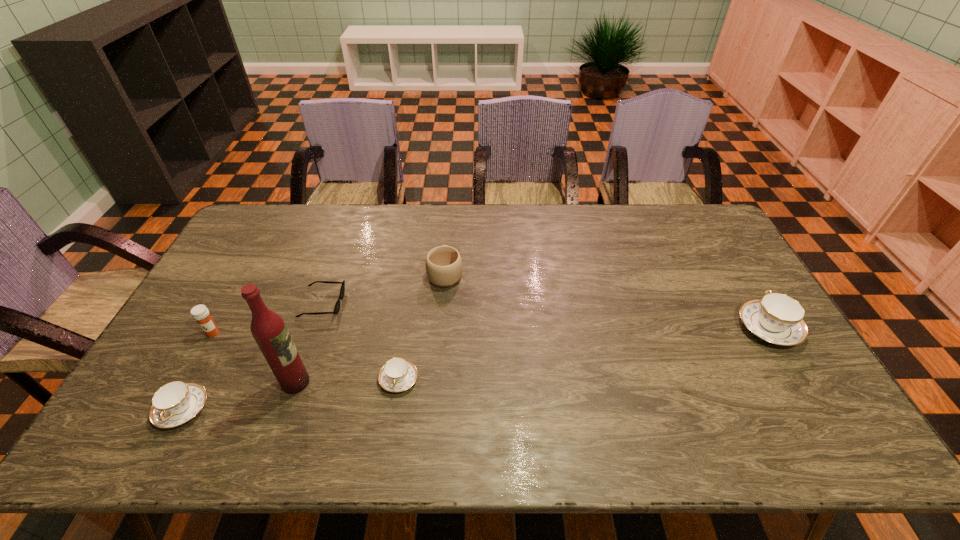
Where is `teacup located at the left edge`? Image resolution: width=960 pixels, height=540 pixels. teacup located at the left edge is located at coordinates (175, 403).

The width and height of the screenshot is (960, 540). What are the coordinates of `medicine positioned at the left edge` in the screenshot? It's located at click(200, 313).

At what (x,y) coordinates should I click in order to perform the action: click on object that is positioned at the right edge. Please return your answer as a coordinate pair (x, y). The image size is (960, 540). Looking at the image, I should click on (776, 318).

Locate an element on the screen. object that is at the near left corner is located at coordinates (175, 403).

Where is `vacant space at the far edge`? vacant space at the far edge is located at coordinates (429, 232).

This screenshot has height=540, width=960. I want to click on free space at the near edge of the desktop, so click(762, 410).

The width and height of the screenshot is (960, 540). I want to click on free space at the left edge of the desktop, so click(x=221, y=263).

Locate an element on the screen. free point at the right edge is located at coordinates (747, 276).

I want to click on vacant area at the far left corner of the desktop, so click(273, 231).

Identify the location of blank region between the shortest object and the third shortest object. (252, 356).